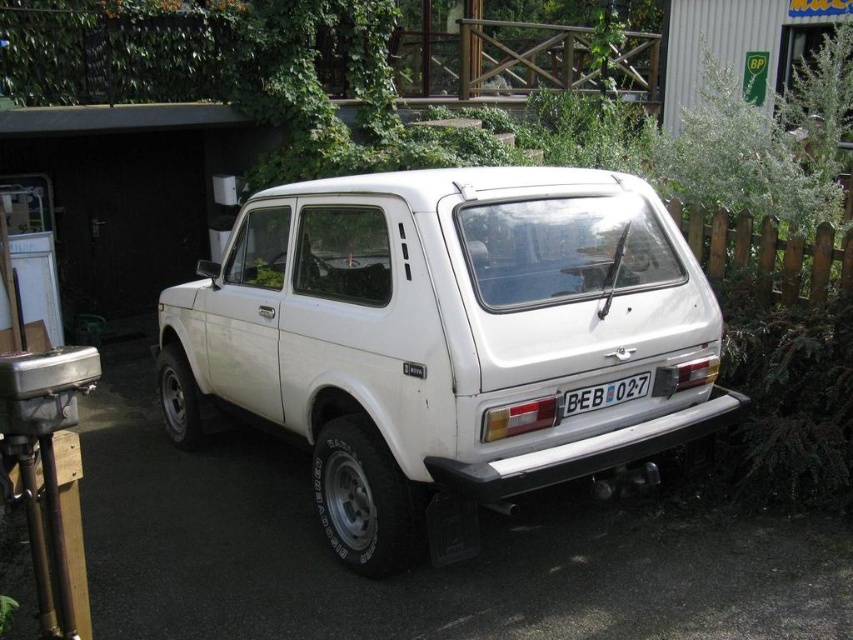
You are a delivery driver who needs to park your truck next to the white matte suv at center. The truck is 2.5 meters wide. Can you park it without overlapping the white plastic license plate at rear?

The white matte suv at center is wider than the white plastic license plate at rear. Since the truck is 2.5 meters wide, it should fit as long as the SUV is at least 2.5 meters wide. However, the exact width of the SUV isn

You are a delivery driver who needs to back up the white matte suv at center into a parking spot. Before doing so, you check the rearview mirror and see the white plastic license plate at rear. Can you safely back up without hitting the wooden fence behind you?

The white matte suv at center is in front of the white plastic license plate at rear, meaning the license plate is attached to the rear of the SUV. Since the wooden fence is behind the SUV, the driver can safely back up as long as they maneuver carefully, keeping an eye on the rearview mirror to avoid hitting the fence.

You are a delivery person trying to park your van next to the white matte suv at center and the white plastic license plate at rear. Based on their heights, which vehicle part might you need to avoid hitting when parking?

The white matte suv at center is much taller than the white plastic license plate at rear, so you should avoid hitting the top of the white matte suv at center when parking.